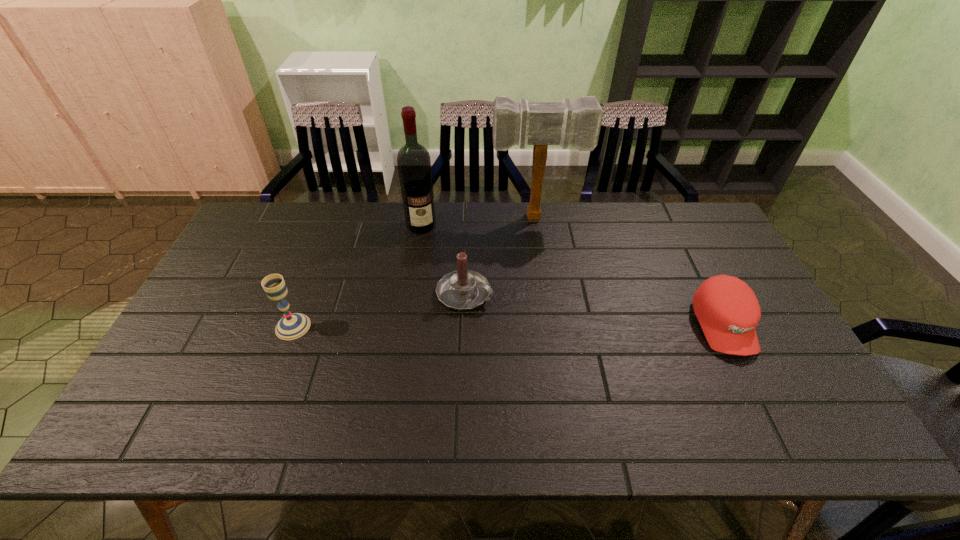
Locate an element on the screen. This screenshot has width=960, height=540. vacant spot on the desktop that is between the leftmost object and the rightmost object and is positioned on the side of the third object from left to right with the handle loop is located at coordinates (533, 326).

The height and width of the screenshot is (540, 960). Find the location of `free spot on the desktop that is between the chalice and the shortest object and is positioned at the head of the fourth object from left to right`. free spot on the desktop that is between the chalice and the shortest object and is positioned at the head of the fourth object from left to right is located at coordinates [550, 326].

The width and height of the screenshot is (960, 540). I want to click on vacant space on the desktop that is between the leftmost object and the shortest object and is positioned on the front and back of the fourth object from right to left, so click(x=447, y=326).